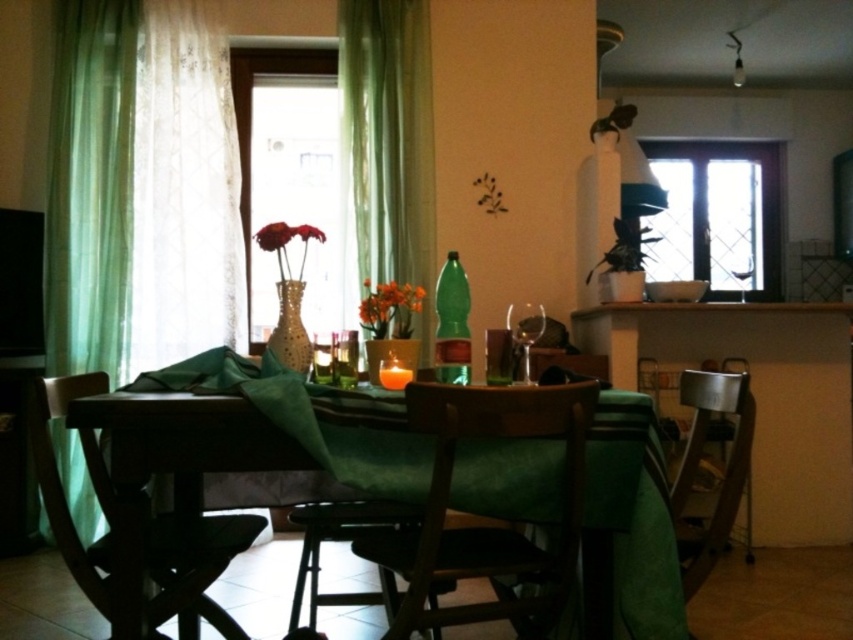
Between wooden table at center and brown wooden chair at lower left, which one appears on the left side from the viewer's perspective?

From the viewer's perspective, brown wooden chair at lower left appears more on the left side.

Which is below, wooden table at center or brown wooden chair at lower left?

Positioned lower is brown wooden chair at lower left.

Is point (531, 509) farther from camera compared to point (96, 573)?

No, it is not.

Locate an element on the screen. wooden table at center is located at coordinates (328, 442).

Between point (666, 250) and point (90, 477), which one is positioned behind?

Point (666, 250)

Can you confirm if transparent glass window at upper right is bigger than brown wooden chair at lower left?

Yes.

This screenshot has width=853, height=640. What do you see at coordinates (718, 216) in the screenshot?
I see `transparent glass window at upper right` at bounding box center [718, 216].

The width and height of the screenshot is (853, 640). I want to click on transparent glass window at upper right, so click(x=718, y=216).

Between green sheer curtain at left and green sheer curtain at center, which one appears on the right side from the viewer's perspective?

From the viewer's perspective, green sheer curtain at center appears more on the right side.

Between green sheer curtain at left and green sheer curtain at center, which one has less height?

green sheer curtain at center is shorter.

Is point (68, 324) positioned in front of point (393, 179)?

Yes, point (68, 324) is in front of point (393, 179).

Identify the location of green sheer curtain at left. This screenshot has width=853, height=640. (90, 186).